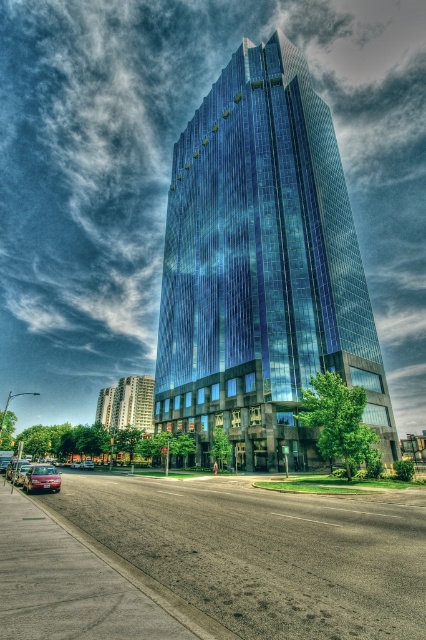
You are a photographer planning to capture the reflection of the shiny glass skyscraper at center in the shiny red sedan at lower left. Based on their positions and sizes, do you think the entire skyscraper will fit within the sedan window?

The shiny glass skyscraper at center is taller than the shiny red sedan at lower left. Therefore, the entire skyscraper may not fit within the sedan window as its height exceeds the sedan.

You are standing on the sidewalk and want to take a photo of the shiny glass skyscraper at center. To ensure the skyscraper is centered in your photo, where should you position yourself relative to the sidewalk?

To center the shiny glass skyscraper at center in your photo, you should position yourself directly in front of the point at coordinates 0.420 on the x axis and 0.615 on the y axis, which corresponds to the skyscraper.

What are the coordinates of the shiny glass skyscraper at center in the image?

The coordinates of the shiny glass skyscraper at center are at point (261,268).